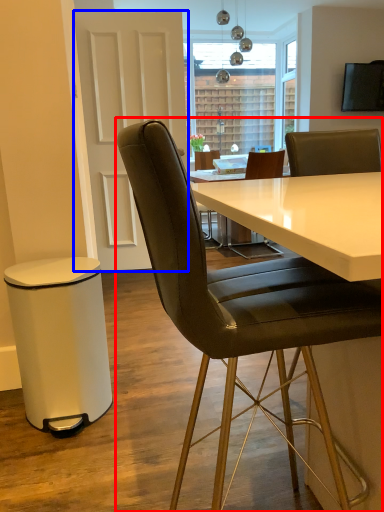
Question: Which object is closer to the camera taking this photo, chair (highlighted by a red box) or glass door (highlighted by a blue box)?

Choices:
 (A) chair
 (B) glass door

Answer: (A)